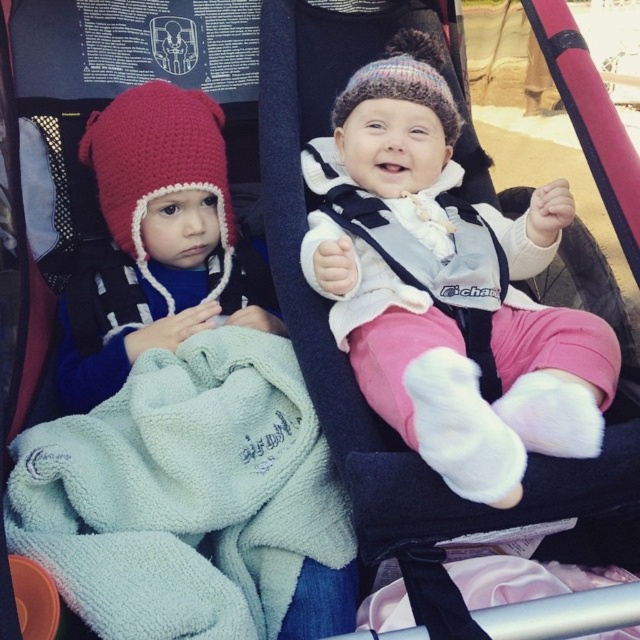
Question: Considering the real-world distances, which object is closest to the knitted woolen hat at center?

Choices:
 (A) matte red knit hat at left
 (B) crochet knit hat at left

Answer: (A)

Question: Is knitted woolen hat at center to the right of crochet knit hat at left from the viewer's perspective?

Choices:
 (A) yes
 (B) no

Answer: (A)

Question: In this image, where is matte red knit hat at left located relative to crochet knit hat at left?

Choices:
 (A) left
 (B) right

Answer: (A)

Question: Can you confirm if knitted woolen hat at center is positioned above crochet knit hat at left?

Choices:
 (A) no
 (B) yes

Answer: (A)

Question: Based on their relative distances, which object is farther from the knitted woolen hat at center?

Choices:
 (A) matte red knit hat at left
 (B) crochet knit hat at left

Answer: (B)

Question: Considering the real-world distances, which object is farthest from the knitted woolen hat at center?

Choices:
 (A) matte red knit hat at left
 (B) crochet knit hat at left

Answer: (B)